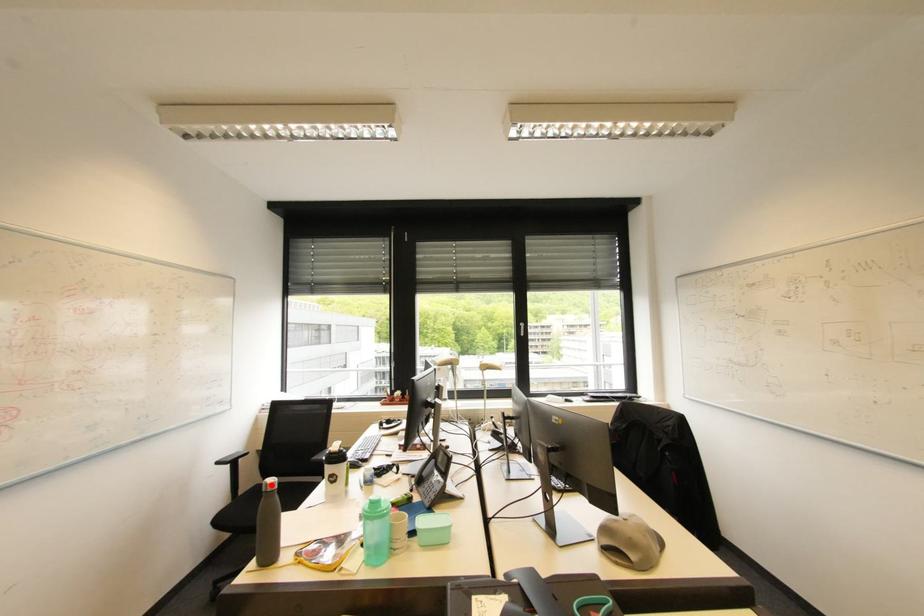
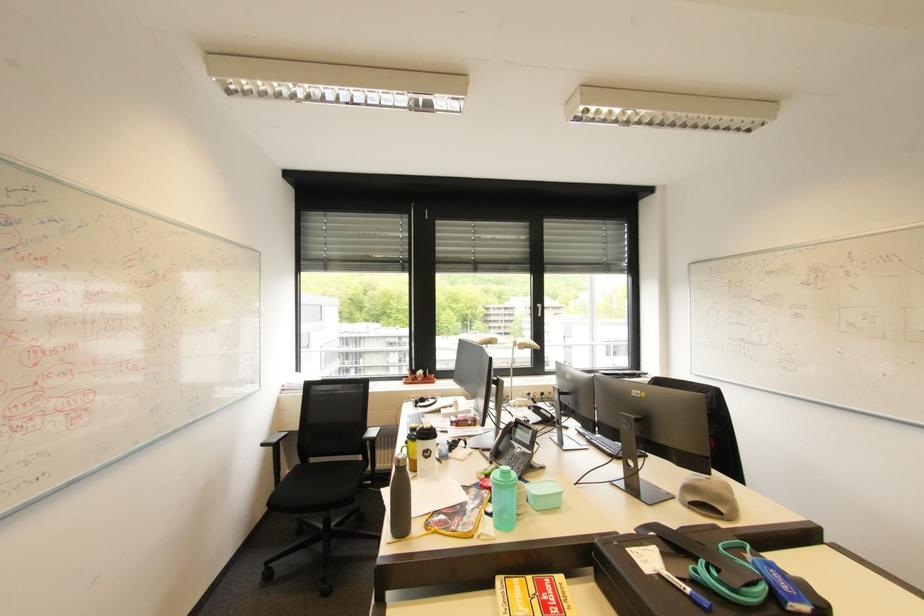
Locate, in the second image, the point that corresponds to the highlighted location in the first image.

(405, 461)